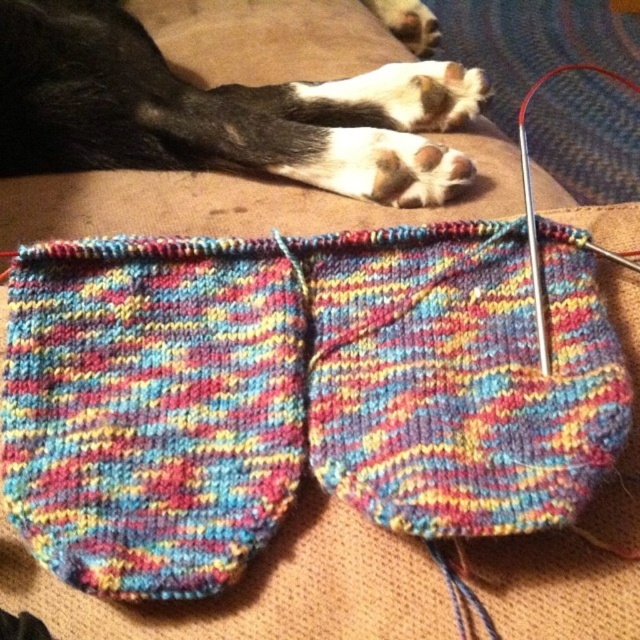
You are a tailor measuring the height of objects in the image. You have a ruler that can only measure up to 10 cm. The multicolored knitted sock at center and the black fur paw at upper left are both within your measurement range. Which object will your ruler be able to measure fully without exceeding its limit?

The multicolored knitted sock at center is not as tall as the black fur paw at upper left. Since the ruler can measure up to 10 cm, if the sock is shorter than the paw, but both are within the 10 cm range, the ruler can fully measure both. However, since the question asks which the ruler can measure fully without exceeding, and the sock is shorter, the answer should focus on the sock being measurable. Wait, but the problem states both are within the 10 cm range. The answer should clarify that both can be,

You are a photographer setting up a shot of the knitted items. You want to ensure the black fur paw at upper left and the metallic silver knitting needle at upper right are both in the frame. Based on their positions, which object is closer to the left edge of the image?

The black fur paw at upper left is closer to the left edge of the image because it is positioned to the left of the metallic silver knitting needle at upper right.

You are a knitter who just finished creating the multicolored knitted sock at center. You want to place it next to the metallic silver knitting needle at upper right for display. Is the sock currently positioned in a place where it can be easily moved to be next to the needle?

The multicolored knitted sock at center is below the metallic silver knitting needle at upper right, so it is already positioned in a place where it can be easily moved to be next to the needle.